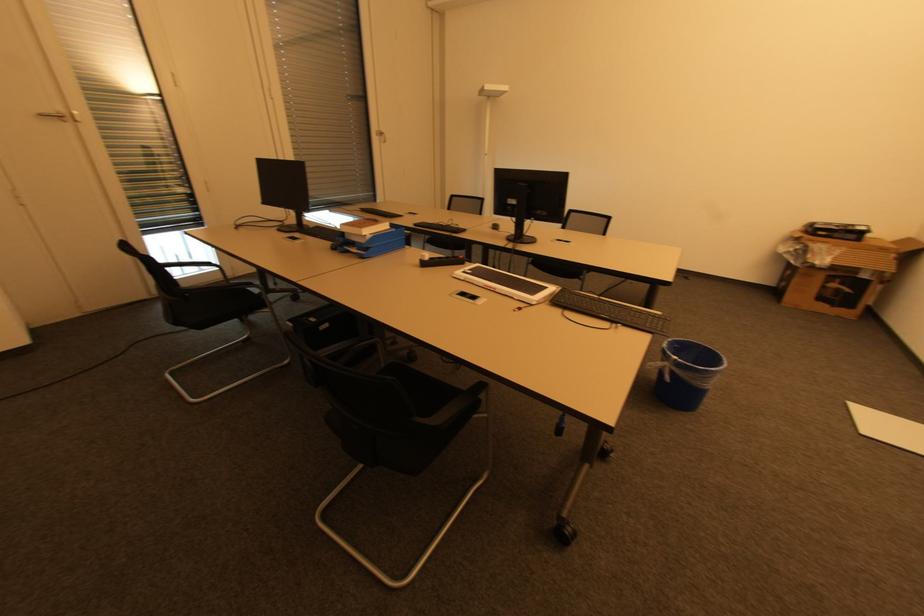
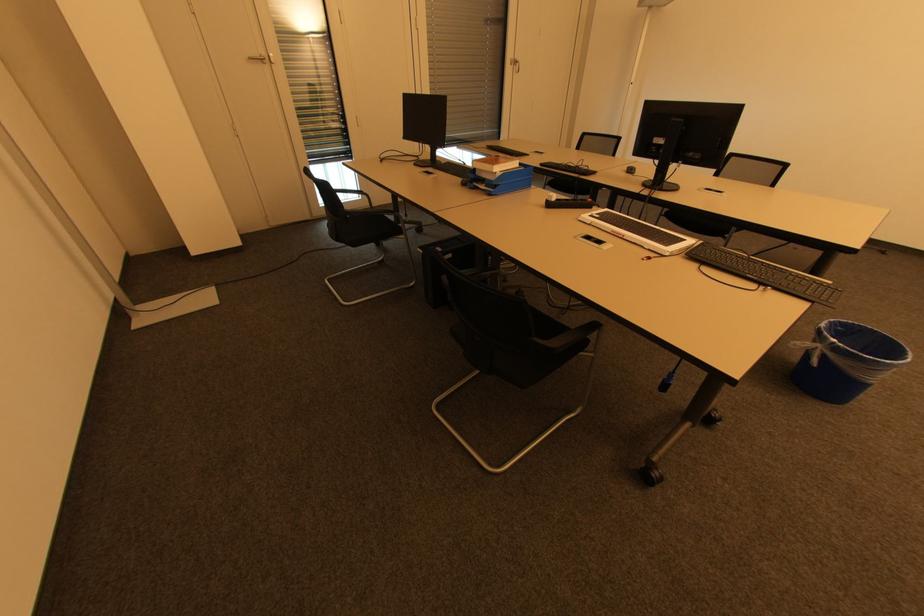
In the second image, find the point that corresponds to (521,237) in the first image.

(660, 183)